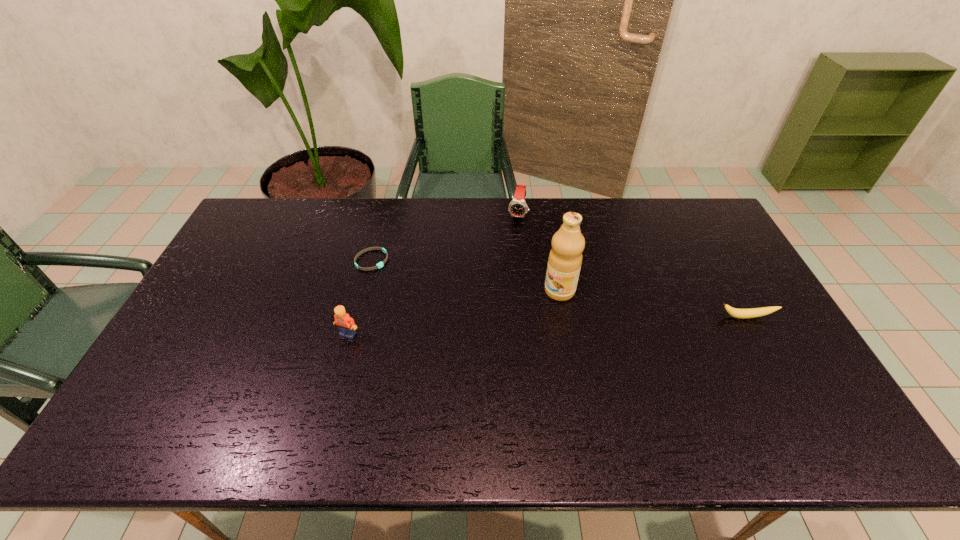
Locate an element on the screen. The image size is (960, 540). free space located on the upward curve of the rightmost object is located at coordinates (762, 346).

The height and width of the screenshot is (540, 960). Find the location of `vacant space located 0.370m on the label of the third farthest object`. vacant space located 0.370m on the label of the third farthest object is located at coordinates click(449, 364).

In order to click on free location located on the label of the third farthest object in this screenshot , I will do `click(495, 333)`.

Find the location of a particular element. This screenshot has width=960, height=540. vacant space situated on the label of the third farthest object is located at coordinates (532, 309).

At what (x,y) coordinates should I click in order to perform the action: click on free space located on the face of the watch. Please return your answer as a coordinate pair (x, y). This screenshot has height=540, width=960. Looking at the image, I should click on coord(511,247).

Identify the location of free space located on the face of the watch. (512, 241).

Locate an element on the screen. Image resolution: width=960 pixels, height=540 pixels. vacant space located 0.390m on the face of the watch is located at coordinates (497, 303).

This screenshot has height=540, width=960. Find the location of `vacant area situated on the buckle of the fourth nearest object`. vacant area situated on the buckle of the fourth nearest object is located at coordinates (462, 311).

You are a GUI agent. You are given a task and a screenshot of the screen. Output one action in this format:
    pyautogui.click(x=<x>, y=<y>)
    Task: Click on the free point located 0.290m on the buckle of the fourth nearest object
    
    Given the screenshot: What is the action you would take?
    pyautogui.click(x=453, y=306)

Locate an element on the screen. free space located on the buckle of the fourth nearest object is located at coordinates (403, 278).